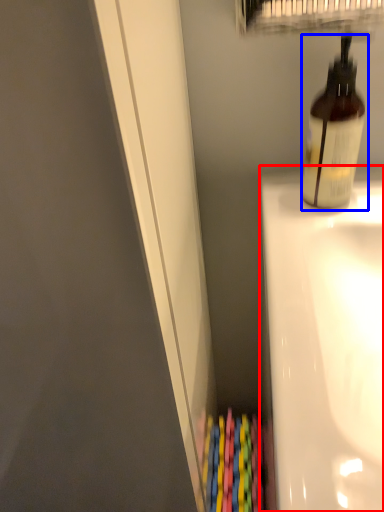
Question: Which of the following is the closest to the observer, bath (highlighted by a red box) or bottle (highlighted by a blue box)?

Choices:
 (A) bath
 (B) bottle

Answer: (A)